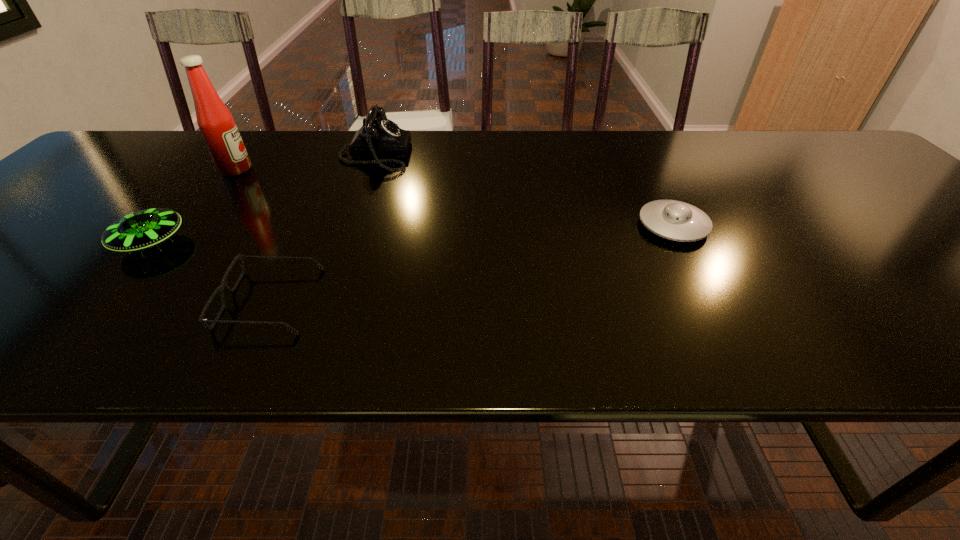
What are the coordinates of `free region located on the back of the rightmost object` in the screenshot? It's located at (646, 176).

Locate an element on the screen. The height and width of the screenshot is (540, 960). vacant region located on the front-facing side of the nearest object is located at coordinates (29, 300).

Identify the location of free spot located on the front-facing side of the nearest object. (167, 300).

At what (x,y) coordinates should I click in order to perform the action: click on vacant space located on the front-facing side of the nearest object. Please return your answer as a coordinate pair (x, y). This screenshot has height=540, width=960. Looking at the image, I should click on (34, 300).

Where is `condiment at the far edge`? The width and height of the screenshot is (960, 540). condiment at the far edge is located at coordinates (216, 123).

The image size is (960, 540). Identify the location of telephone located in the far edge section of the desktop. (379, 136).

Image resolution: width=960 pixels, height=540 pixels. I want to click on object situated at the near edge, so click(x=202, y=321).

Identify the location of vacant space at the far edge of the desktop. This screenshot has height=540, width=960. (550, 130).

The image size is (960, 540). I want to click on free region at the near edge of the desktop, so click(312, 332).

The image size is (960, 540). Find the location of `vacant area at the left edge of the desktop`. vacant area at the left edge of the desktop is located at coordinates (45, 212).